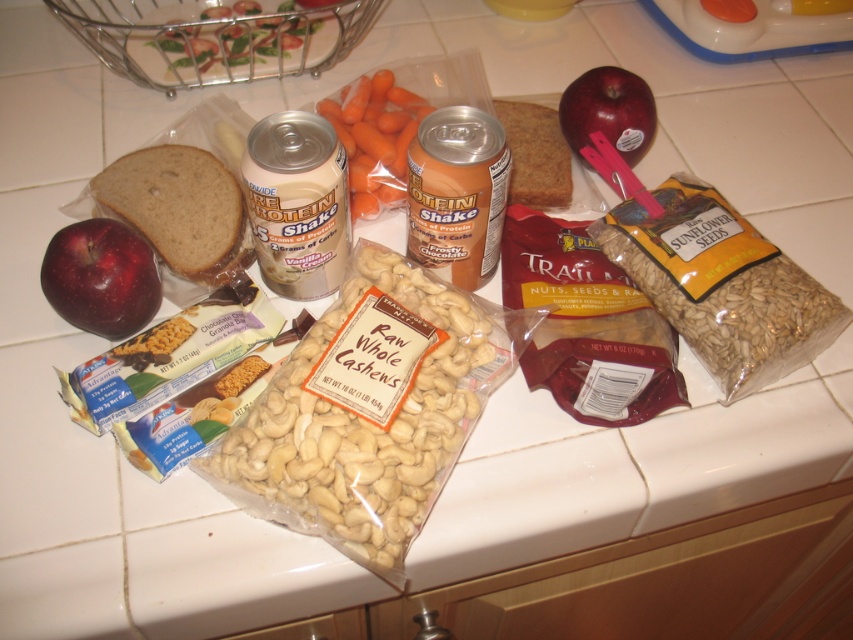
Is point (102, 276) farther from viewer compared to point (590, 131)?

No.

Is point (138, 257) positioned before point (608, 83)?

Yes, point (138, 257) is closer to viewer.

Where is `red matte apple at left`? red matte apple at left is located at coordinates (102, 276).

Who is positioned more to the left, light beige raw whole cashews at center or red matte apple at upper right?

Positioned to the left is light beige raw whole cashews at center.

Does light beige raw whole cashews at center come in front of red matte apple at upper right?

Yes.

Locate an element on the screen. This screenshot has width=853, height=640. light beige raw whole cashews at center is located at coordinates (363, 422).

Locate an element on the screen. light beige raw whole cashews at center is located at coordinates (363, 422).

Between brown matte bread at left and red matte apple at upper right, which one appears on the right side from the viewer's perspective?

red matte apple at upper right

From the picture: Is brown matte bread at left shorter than red matte apple at upper right?

Incorrect, brown matte bread at left's height does not fall short of red matte apple at upper right's.

The width and height of the screenshot is (853, 640). I want to click on brown matte bread at left, so click(180, 209).